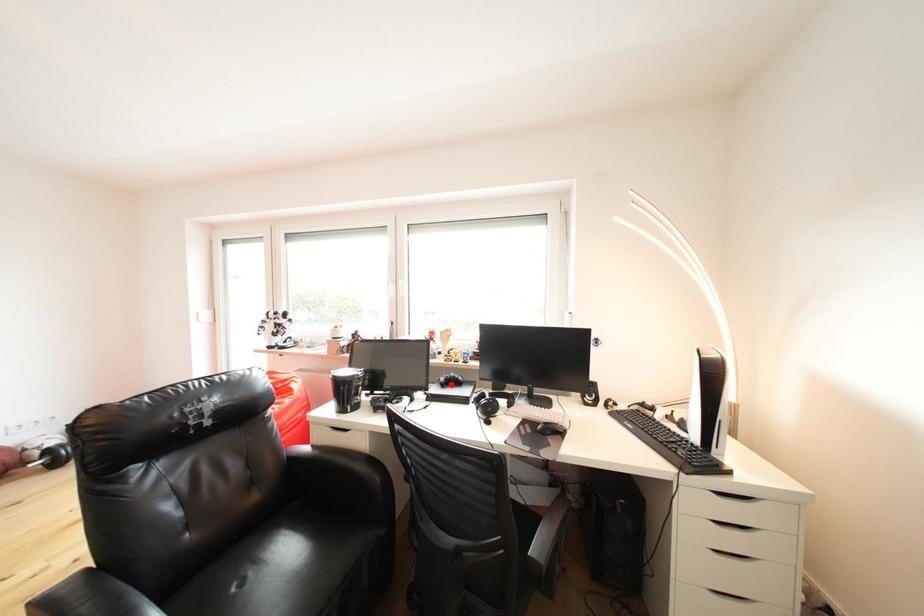
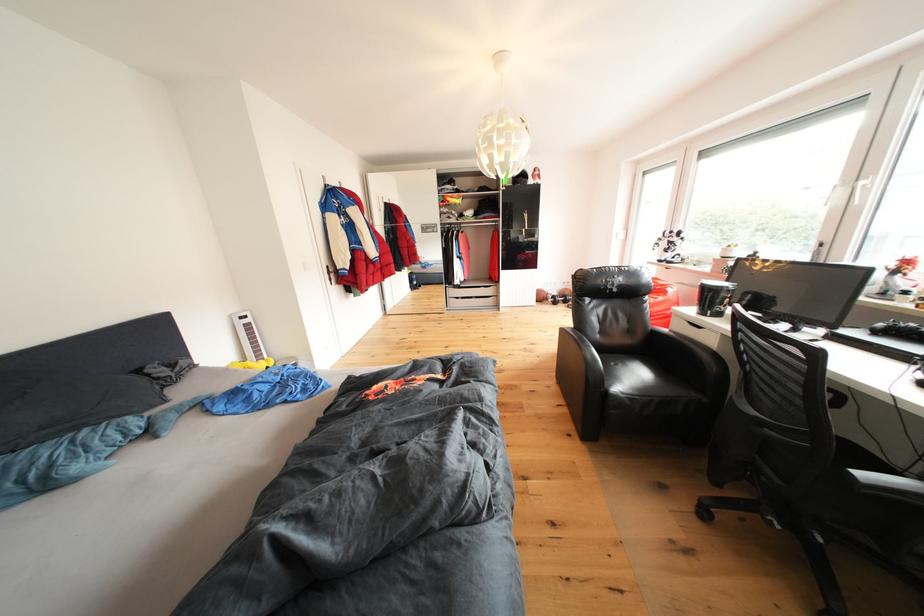
In the second image, find the point that corresponds to the highlighted location in the first image.

(890, 330)